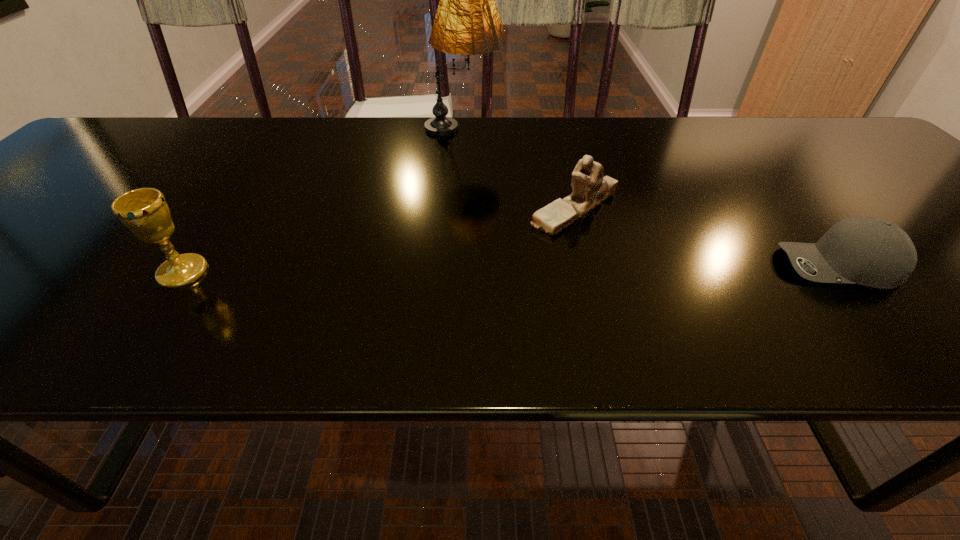
Where is `object that ranks as the second closest to the baseball cap`? This screenshot has width=960, height=540. object that ranks as the second closest to the baseball cap is located at coordinates (467, 22).

You are a GUI agent. You are given a task and a screenshot of the screen. Output one action in this format:
    pyautogui.click(x=<x>, y=<y>)
    Task: Click on the third closest object to the leftmost object
    
    Given the screenshot: What is the action you would take?
    pyautogui.click(x=873, y=252)

Locate an element on the screen. free space in the image that satisfies the following two spatial constraints: 1. on the front-facing side of the tallest object; 2. on the front side of the leftmost object is located at coordinates (456, 272).

Locate an element on the screen. This screenshot has width=960, height=540. vacant space that satisfies the following two spatial constraints: 1. on the front brim of the baseball cap; 2. on the front side of the second tallest object is located at coordinates (843, 272).